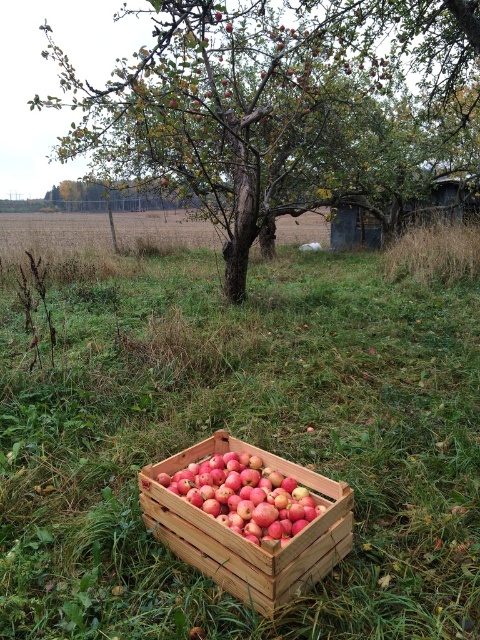
Is green leafy tree at center wider than red matte apples at center?

Indeed, green leafy tree at center has a greater width compared to red matte apples at center.

Which is below, green leafy tree at center or red matte apples at center?

Positioned lower is red matte apples at center.

Image resolution: width=480 pixels, height=640 pixels. I want to click on green leafy tree at center, so click(283, 108).

Does green grass at center appear on the right side of wooden crate at center?

In fact, green grass at center is to the left of wooden crate at center.

Is the position of green grass at center more distant than that of wooden crate at center?

Yes, green grass at center is further from the viewer.

Is point (1, 256) positioned behind point (300, 552)?

Yes, point (1, 256) is farther from viewer.

The image size is (480, 640). I want to click on green grass at center, so click(x=240, y=436).

Who is more forward, [384,637] or [282,497]?

Positioned in front is point [384,637].

How far apart are green grass at center and red matte apples at center?

A distance of 68.26 centimeters exists between green grass at center and red matte apples at center.

Between point (103, 483) and point (231, 456), which one is positioned behind?

The point (103, 483) is behind.

Where is `green grass at center`? Image resolution: width=480 pixels, height=640 pixels. green grass at center is located at coordinates [240, 436].